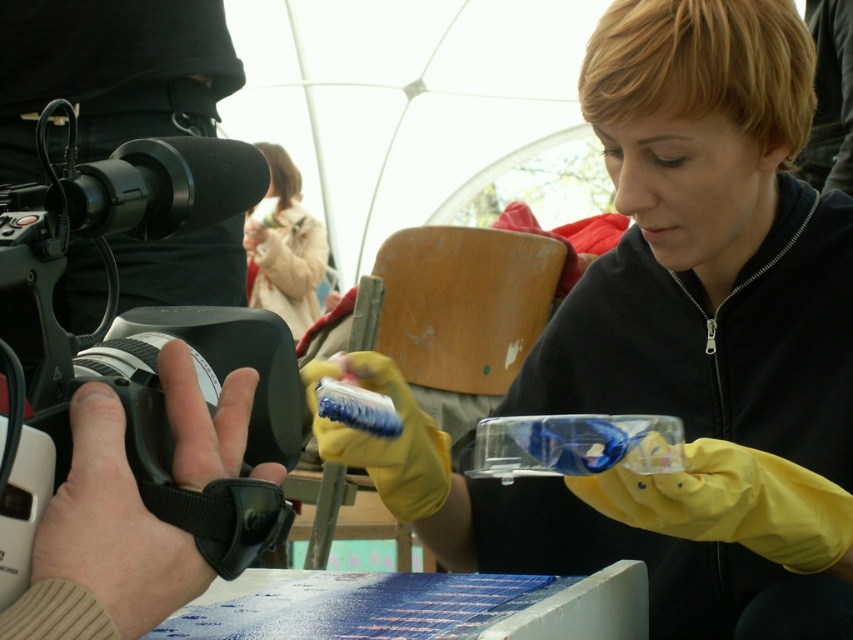
Can you confirm if yellow rubber gloves at center is thinner than fuzzy beige coat at upper left?

No, yellow rubber gloves at center is not thinner than fuzzy beige coat at upper left.

Between point (357, 353) and point (258, 284), which one is positioned behind?

Positioned behind is point (258, 284).

Which is behind, point (808, 253) or point (254, 300)?

Positioned behind is point (254, 300).

Identify the location of yellow rubber gloves at center. click(x=676, y=337).

Who is taller, black plastic video camera at left or fuzzy beige coat at upper left?

With more height is fuzzy beige coat at upper left.

Who is more distant from viewer, (154,364) or (280,291)?

The point (280,291) is more distant.

Between point (6, 268) and point (267, 308), which one is positioned behind?

Point (267, 308)

You are a GUI agent. You are given a task and a screenshot of the screen. Output one action in this format:
    pyautogui.click(x=<x>, y=<y>)
    Task: Click on the black plastic video camera at left
    This screenshot has width=853, height=640.
    Given the screenshot: What is the action you would take?
    pyautogui.click(x=136, y=340)

Which is behind, point (685, 67) or point (253, 484)?

The point (685, 67) is more distant.

Does yellow rubber gloves at center have a greater width compared to black plastic video camera at left?

Indeed, yellow rubber gloves at center has a greater width compared to black plastic video camera at left.

Which is behind, point (698, 225) or point (59, 467)?

The point (698, 225) is behind.

At what (x,y) coordinates should I click in order to perform the action: click on yellow rubber gloves at center. Please return your answer as a coordinate pair (x, y). Looking at the image, I should click on (676, 337).